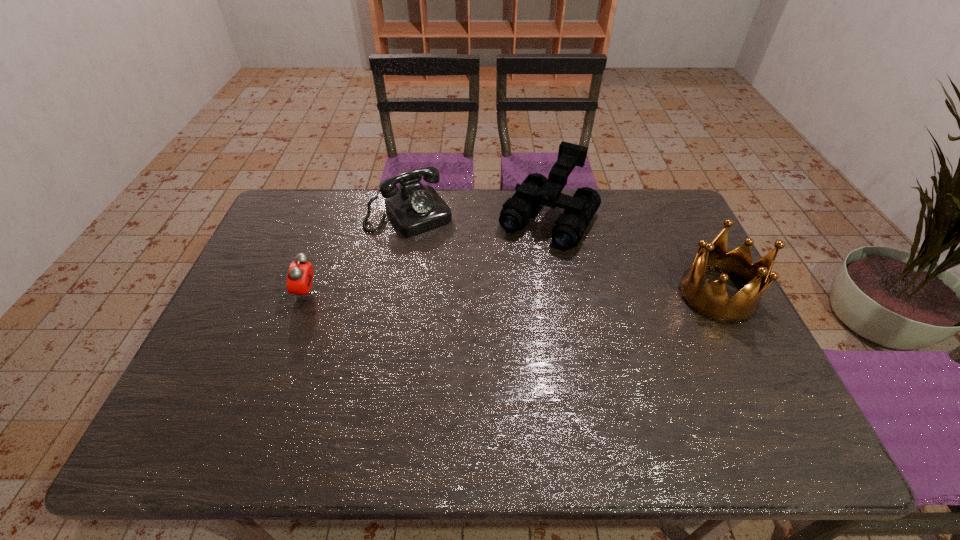
I want to click on the leftmost object, so click(x=300, y=275).

Locate an element on the screen. The height and width of the screenshot is (540, 960). alarm clock is located at coordinates (300, 275).

Where is `crown`? The image size is (960, 540). crown is located at coordinates (711, 301).

Image resolution: width=960 pixels, height=540 pixels. Find the location of `the third object from right to left`. the third object from right to left is located at coordinates (414, 208).

Locate an element on the screen. the second object from right to left is located at coordinates (536, 189).

This screenshot has height=540, width=960. I want to click on vacant space situated on the left of the rightmost object, so click(659, 295).

Find the location of a particular element. free spot located 0.350m on the dial of the telephone is located at coordinates (480, 306).

This screenshot has width=960, height=540. Identify the location of free spot located on the dial of the telephone. (440, 250).

The image size is (960, 540). I want to click on free location located 0.300m on the dial of the telephone, so click(471, 294).

Where is `free space located 0.310m on the front lenses of the binoculars`? This screenshot has height=540, width=960. free space located 0.310m on the front lenses of the binoculars is located at coordinates (483, 320).